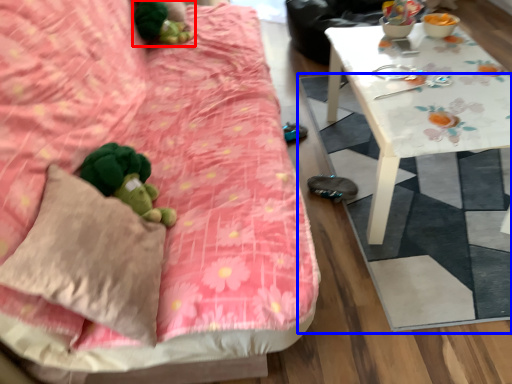
Question: Which point is further to the camera, miniature (highlighted by a red box) or mat (highlighted by a blue box)?

Choices:
 (A) miniature
 (B) mat

Answer: (A)